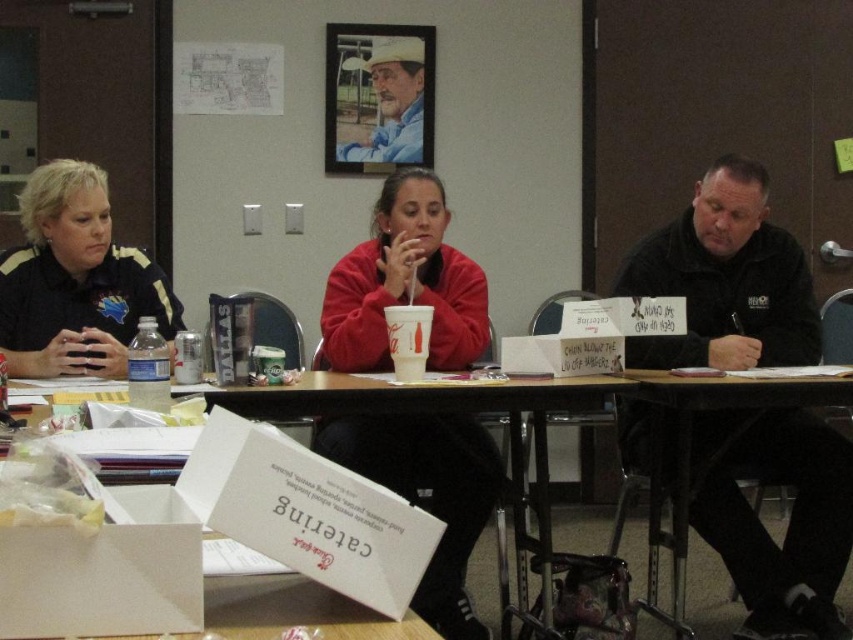
You are organizing a charity event and need to place a 1.2 meter wide banner between the black matte jacket at center and the rustic wood frame at upper center. Based on their relative widths, will the banner fit horizontally between them?

The black matte jacket at center might be wider than rustic wood frame at upper center, so the banner may not fit horizontally between them due to the jacket possibly taking up more space.

You are standing in the meeting room and need to place a white cardboard box at the exact location marked by the point with coordinates (x=544, y=429). Based on the scene description, where should you place the white cardboard box?

The white cardboard box should be placed at the lower center of the scene, as the coordinates (x=544, y=429) correspond to the lower center position in the image.

Based on the photo, you are a photographer setting up a shoot in the meeting room. You need to ensure that the black matte jacket at center and the rustic wood frame at upper center are both visible in the shot. Given their heights, which object should you position closer to the camera to ensure both are fully visible?

The black matte jacket at center is taller than the rustic wood frame at upper center. To ensure both are fully visible, position the black matte jacket at center closer to the camera so its height doesn